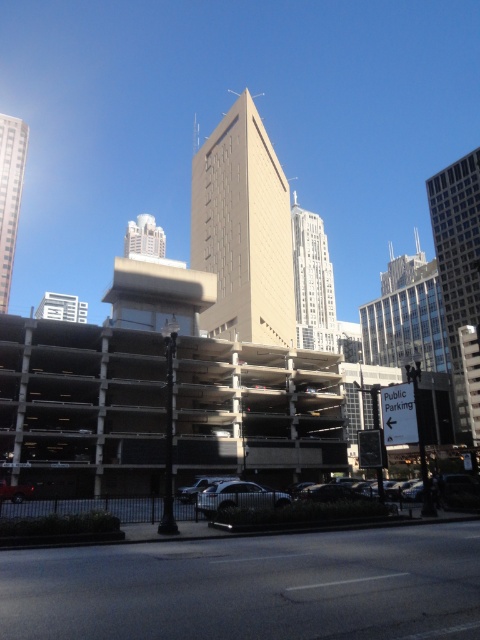
You are a delivery driver approaching the shiny silver sedan at center and the matte glass skyscraper at upper left. Which object is positioned more to the right in the scene?

The shiny silver sedan at center is positioned to the right of the matte glass skyscraper at upper left, so it is more to the right.

You are a delivery driver who needs to park your shiny silver sedan at center in a spot that requires precise alignment. The parking spot has a center marker at point 0.767, 0.692. Is your car already aligned with the center marker?

The shiny silver sedan at center is exactly positioned at point (332, 490), so it is perfectly aligned with the center marker.

Based on the photo, you are a photographer trying to capture the shiny silver sedan at center and the matte glass skyscraper at upper left in the same frame. Based on their heights, which object will appear taller in the photo?

The matte glass skyscraper at upper left will appear taller in the photo since it has a greater height than the shiny silver sedan at center.